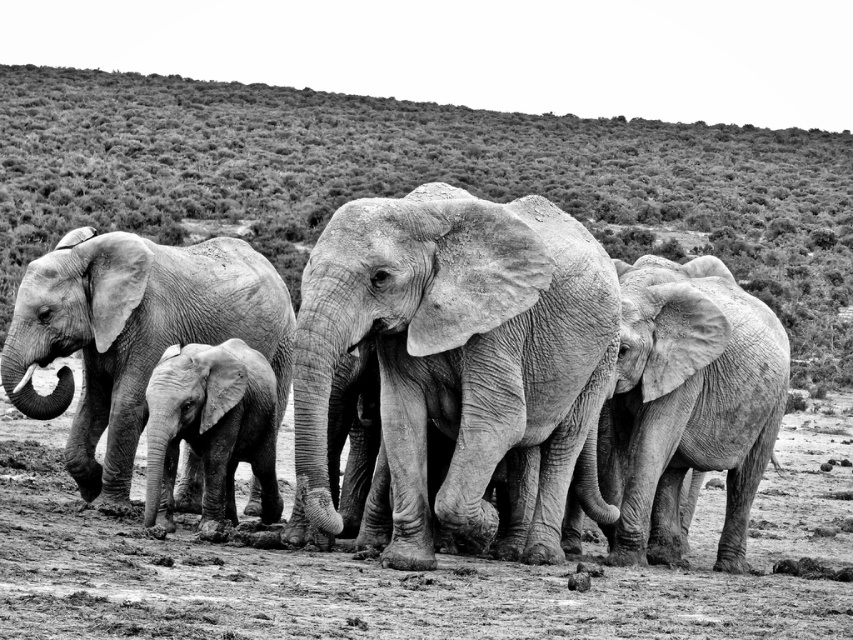
Question: Which object is closer to the camera taking this photo?

Choices:
 (A) gray textured baby elephant at center
 (B) gray textured elephant at left
 (C) gray textured elephants at center

Answer: (A)

Question: Estimate the real-world distances between objects in this image. Which object is farther from the gray textured elephant at right?

Choices:
 (A) dirt field at center
 (B) gray textured baby elephant at center
 (C) gray textured elephants at center
 (D) gray textured elephant at center

Answer: (B)

Question: Considering the relative positions of dirt field at center and gray textured elephant at left in the image provided, where is dirt field at center located with respect to gray textured elephant at left?

Choices:
 (A) below
 (B) above

Answer: (A)

Question: Does gray textured elephant at left appear under gray textured elephant at right?

Choices:
 (A) yes
 (B) no

Answer: (A)

Question: Considering the real-world distances, which object is farthest from the gray textured elephants at center?

Choices:
 (A) dirt field at center
 (B) gray textured elephant at left

Answer: (B)

Question: Can you confirm if gray textured elephant at left is bigger than gray textured elephant at right?

Choices:
 (A) yes
 (B) no

Answer: (B)